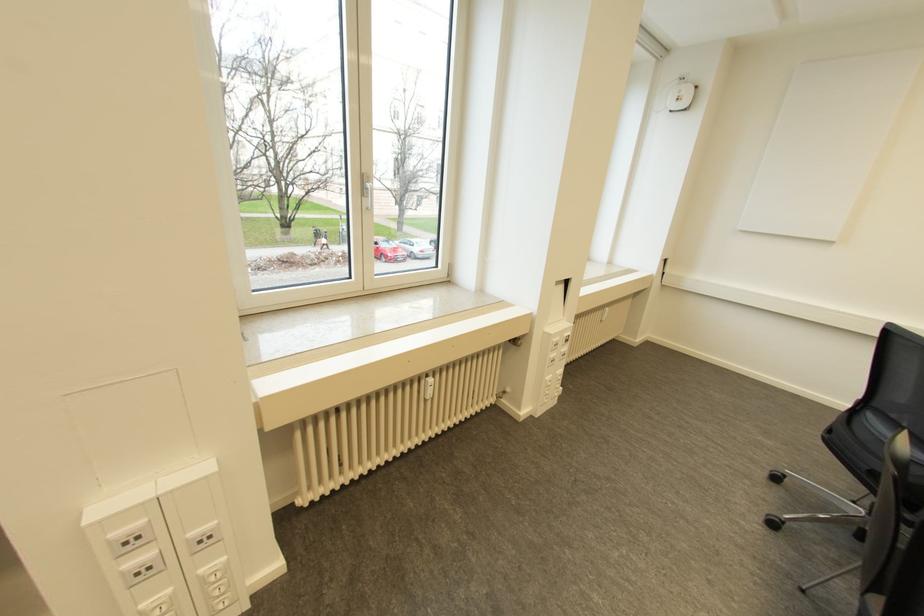
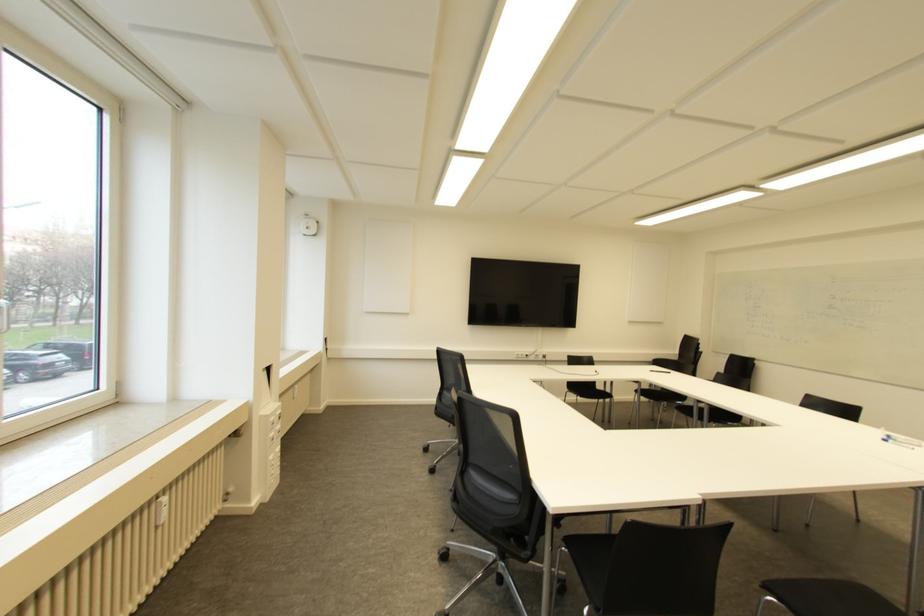
Where in the second image is the point corresponding to the point at 430,379 from the first image?

(163, 499)